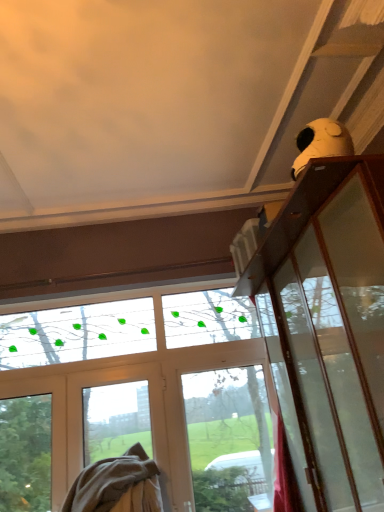
Question: Is beige cotton blanket at lower left bigger or smaller than white matte screen door at lower left?

Choices:
 (A) big
 (B) small

Answer: (A)

Question: Considering the positions of beige cotton blanket at lower left and white matte screen door at lower left in the image, is beige cotton blanket at lower left taller or shorter than white matte screen door at lower left?

Choices:
 (A) tall
 (B) short

Answer: (B)

Question: Considering the positions of point (109, 463) and point (122, 442), is point (109, 463) closer or farther from the camera than point (122, 442)?

Choices:
 (A) farther
 (B) closer

Answer: (B)

Question: From the image's perspective, is white matte screen door at lower left located above or below beige cotton blanket at lower left?

Choices:
 (A) above
 (B) below

Answer: (A)

Question: In the image, is white matte screen door at lower left positioned in front of or behind beige cotton blanket at lower left?

Choices:
 (A) front
 (B) behind

Answer: (B)

Question: Which is correct: white matte screen door at lower left is inside beige cotton blanket at lower left, or outside of it?

Choices:
 (A) outside
 (B) inside

Answer: (A)

Question: Would you say white matte screen door at lower left is to the left or to the right of beige cotton blanket at lower left in the picture?

Choices:
 (A) left
 (B) right

Answer: (B)